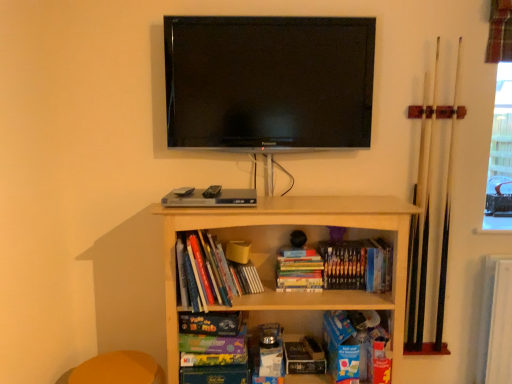
Question: Considering the positions of point (300, 337) and point (393, 233), is point (300, 337) closer or farther from the camera than point (393, 233)?

Choices:
 (A) closer
 (B) farther

Answer: (B)

Question: Is hardcover book at center, positioned as the 3th paperback book in left-to-right order, taller or shorter than wooden shelf at center?

Choices:
 (A) short
 (B) tall

Answer: (A)

Question: Based on their relative distances, which object is nearer to the hardcover books at center, arranged as the second book when viewed from the right?

Choices:
 (A) orange fabric swivel chair at lower left
 (B) hardcover book at center, which is counted as the third book, starting from the left
 (C) flat screen tv at upper center
 (D) hardcover books at center, the first book viewed from the left
 (E) matte purple paperback book at center, which is counted as the 2th paperback book, starting from the bottom

Answer: (B)

Question: Which object is the closest to the wooden shelf at center?

Choices:
 (A) orange fabric swivel chair at lower left
 (B) hardcover books at center, the first book viewed from the left
 (C) hardcover book at center, which is the 1th book from right to left
 (D) hardcover books at center, arranged as the second book when viewed from the right
 (E) matte purple paperback book at center, the 2th paperback book positioned from the top

Answer: (C)